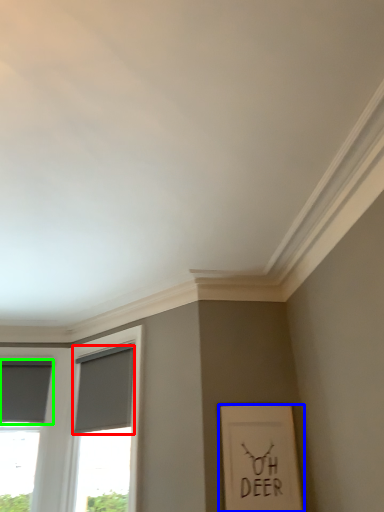
Question: Which object is positioned closest to curtain (highlighted by a red box)? Select from picture frame (highlighted by a blue box) and curtain (highlighted by a green box).

Choices:
 (A) picture frame
 (B) curtain

Answer: (B)